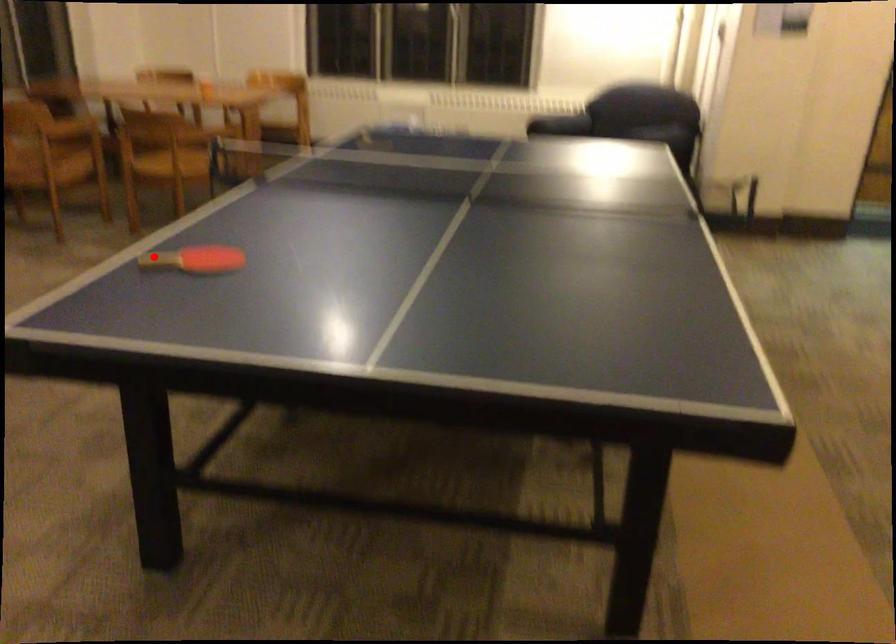
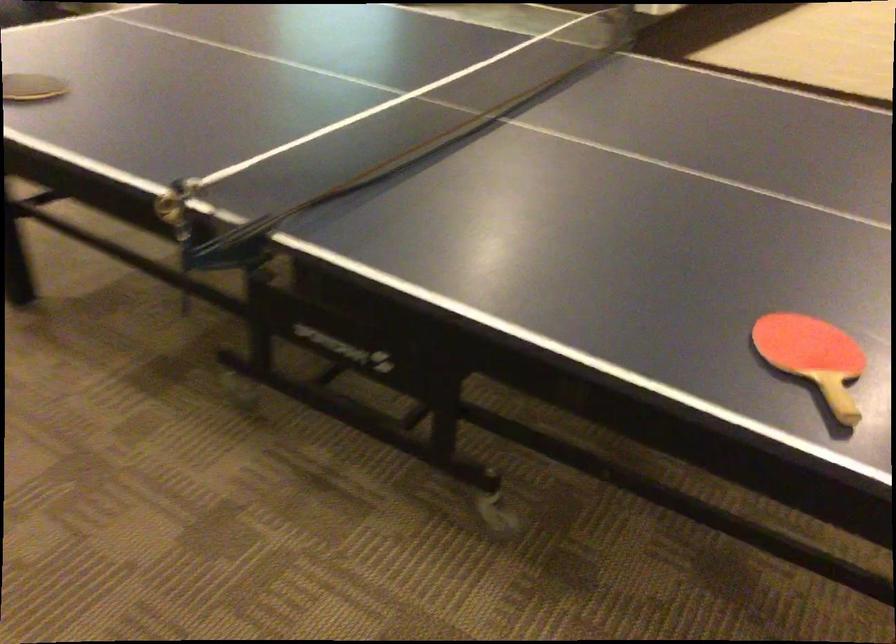
Locate, in the second image, the point that corresponds to the highlighted location in the first image.

(813, 357)